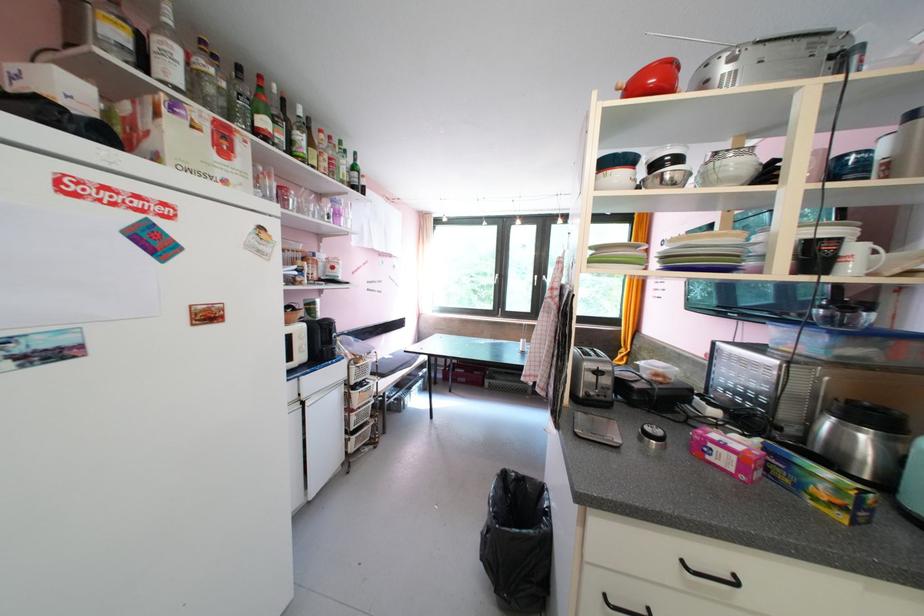
What do you see at coordinates (711, 575) in the screenshot? I see `the white cabinet handle` at bounding box center [711, 575].